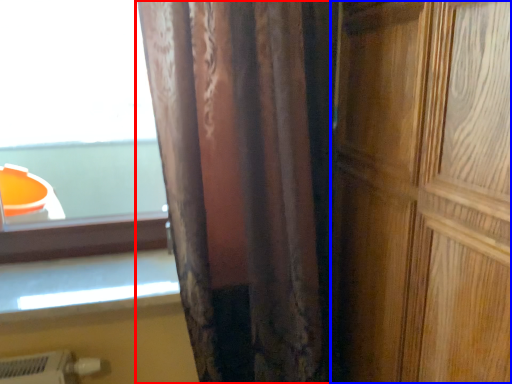
Question: Which of the following is the farthest to the observer, curtain (highlighted by a red box) or door (highlighted by a blue box)?

Choices:
 (A) curtain
 (B) door

Answer: (A)